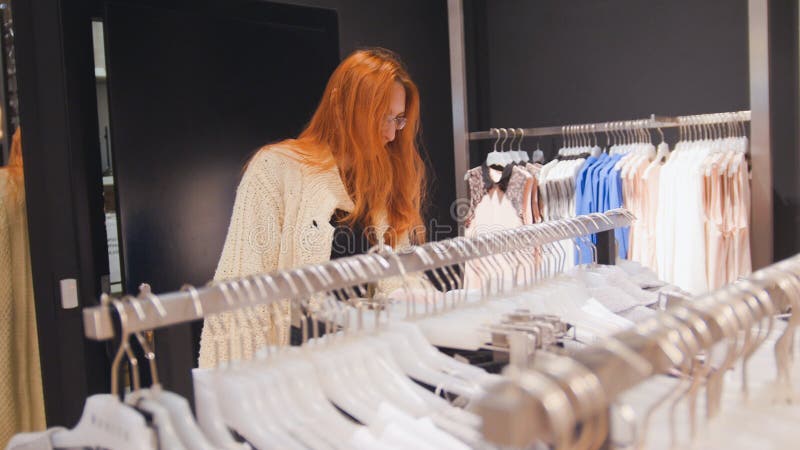
Locate an element on the screen. The width and height of the screenshot is (800, 450). gray vertical wall fixtures is located at coordinates (756, 60), (458, 82).